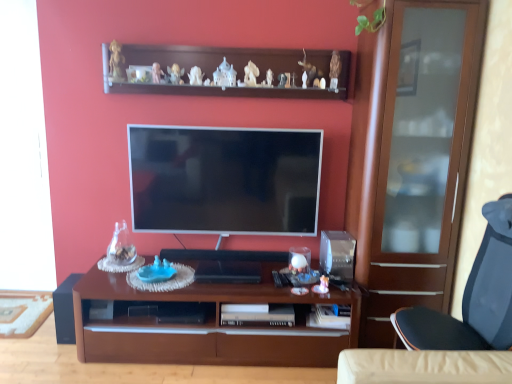
Question: Is white glossy television at center positioned with its back to black matte speaker at lower left?

Choices:
 (A) yes
 (B) no

Answer: (B)

Question: From the image's perspective, is white glossy television at center on black matte speaker at lower left?

Choices:
 (A) no
 (B) yes

Answer: (B)

Question: Is white glossy television at center bigger than black matte speaker at lower left?

Choices:
 (A) yes
 (B) no

Answer: (A)

Question: Is white glossy television at center to the left of black matte speaker at lower left from the viewer's perspective?

Choices:
 (A) no
 (B) yes

Answer: (A)

Question: Is white glossy television at center wider than black matte speaker at lower left?

Choices:
 (A) yes
 (B) no

Answer: (B)

Question: Considering the positions of wooden desk at center and wooden shelf at upper center in the image, is wooden desk at center wider or thinner than wooden shelf at upper center?

Choices:
 (A) wide
 (B) thin

Answer: (A)

Question: In terms of height, does wooden desk at center look taller or shorter compared to wooden shelf at upper center?

Choices:
 (A) short
 (B) tall

Answer: (B)

Question: From the image's perspective, is wooden desk at center above or below wooden shelf at upper center?

Choices:
 (A) below
 (B) above

Answer: (A)

Question: Considering the positions of wooden desk at center and wooden shelf at upper center in the image, is wooden desk at center bigger or smaller than wooden shelf at upper center?

Choices:
 (A) big
 (B) small

Answer: (A)

Question: Is blue plastic toy at center inside or outside of wooden desk at center?

Choices:
 (A) inside
 (B) outside

Answer: (B)

Question: In terms of height, does blue plastic toy at center look taller or shorter compared to wooden desk at center?

Choices:
 (A) short
 (B) tall

Answer: (A)

Question: From a real-world perspective, relative to wooden desk at center, is blue plastic toy at center vertically above or below?

Choices:
 (A) below
 (B) above

Answer: (B)

Question: Looking at the image, does blue plastic toy at center seem bigger or smaller compared to wooden desk at center?

Choices:
 (A) big
 (B) small

Answer: (B)

Question: Based on their positions, is black matte speaker at lower left located to the left or right of blue plastic toy at center?

Choices:
 (A) left
 (B) right

Answer: (A)

Question: From a real-world perspective, relative to blue plastic toy at center, is black matte speaker at lower left vertically above or below?

Choices:
 (A) below
 (B) above

Answer: (A)